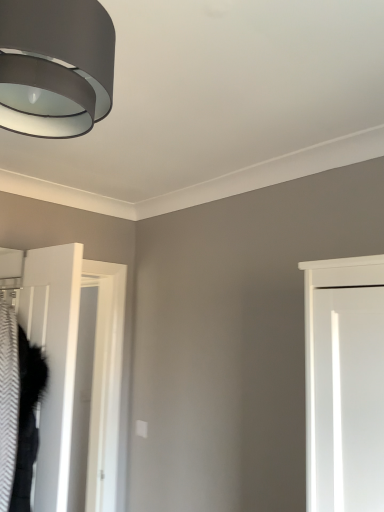
This screenshot has width=384, height=512. What do you see at coordinates (55, 66) in the screenshot? I see `matte black lampshade at upper left` at bounding box center [55, 66].

Measure the distance between matte black lampshade at upper left and camera.

matte black lampshade at upper left is 25.00 inches from camera.

At what (x,y) coordinates should I click in order to perform the action: click on matte black lampshade at upper left. Please return your answer as a coordinate pair (x, y). This screenshot has width=384, height=512. Looking at the image, I should click on (55, 66).

Describe the element at coordinates (75, 374) in the screenshot. I see `white matte door at left` at that location.

Find the location of a particular element. This screenshot has height=512, width=384. white matte door at left is located at coordinates (75, 374).

Locate an element on the screen. This screenshot has height=512, width=384. matte black lampshade at upper left is located at coordinates (55, 66).

Is matte black lampshade at upper left to the right of white matte door at left from the viewer's perspective?

Yes, matte black lampshade at upper left is to the right of white matte door at left.

Is matte black lampshade at upper left positioned behind white matte door at left?

No, the depth of matte black lampshade at upper left is less than that of white matte door at left.

Is point (48, 68) positioned behind point (54, 379)?

That is False.

From the image's perspective, is matte black lampshade at upper left below white matte door at left?

No, from the image's perspective, matte black lampshade at upper left is not beneath white matte door at left.

From a real-world perspective, does matte black lampshade at upper left sit lower than white matte door at left?

No, from a real-world perspective, matte black lampshade at upper left is not under white matte door at left.

Consider the image. Considering the relative sizes of matte black lampshade at upper left and white matte door at left in the image provided, is matte black lampshade at upper left wider than white matte door at left?

Yes, matte black lampshade at upper left is wider than white matte door at left.

Considering the relative sizes of matte black lampshade at upper left and white matte door at left in the image provided, is matte black lampshade at upper left shorter than white matte door at left?

Yes, matte black lampshade at upper left is shorter than white matte door at left.

Between matte black lampshade at upper left and white matte door at left, which one has larger size?

white matte door at left is bigger.

Is matte black lampshade at upper left completely or partially outside of white matte door at left?

Indeed, matte black lampshade at upper left is completely outside white matte door at left.

Is matte black lampshade at upper left far from white matte door at left?

Absolutely, matte black lampshade at upper left is distant from white matte door at left.

Is matte black lampshade at upper left oriented away from white matte door at left?

That's not correct — matte black lampshade at upper left is not looking away from white matte door at left.

Measure the distance between matte black lampshade at upper left and white matte door at left.

They are 5.99 feet apart.

The width and height of the screenshot is (384, 512). I want to click on door below the matte black lampshade at upper left (from a real-world perspective), so click(75, 374).

Which object is positioned more to the right, white matte door at left or matte black lampshade at upper left?

matte black lampshade at upper left is more to the right.

In the scene shown: Which object is further away from the camera, white matte door at left or matte black lampshade at upper left?

white matte door at left is behind.

Which is behind, point (113, 392) or point (59, 9)?

The point (113, 392) is more distant.

From the picture: From the image's perspective, between white matte door at left and matte black lampshade at upper left, who is located below?

white matte door at left is shown below in the image.

From a real-world perspective, is white matte door at left on matte black lampshade at upper left?

No, from a real-world perspective, white matte door at left is not on top of matte black lampshade at upper left.

Considering the sizes of white matte door at left and matte black lampshade at upper left in the image, is white matte door at left wider or thinner than matte black lampshade at upper left?

Clearly, white matte door at left has less width compared to matte black lampshade at upper left.

Who is shorter, white matte door at left or matte black lampshade at upper left?

matte black lampshade at upper left.

Considering the sizes of objects white matte door at left and matte black lampshade at upper left in the image provided, who is bigger, white matte door at left or matte black lampshade at upper left?

With larger size is white matte door at left.

Is white matte door at left positioned beyond the bounds of matte black lampshade at upper left?

Yes, white matte door at left is outside of matte black lampshade at upper left.

Is there a large distance between white matte door at left and matte black lampshade at upper left?

Yes, white matte door at left and matte black lampshade at upper left are quite far apart.

Is white matte door at left turned away from matte black lampshade at upper left?

No, white matte door at left is not facing the opposite direction of matte black lampshade at upper left.

How different are the orientations of white matte door at left and matte black lampshade at upper left in degrees?

The facing directions of white matte door at left and matte black lampshade at upper left are 80.4 degrees apart.

This screenshot has height=512, width=384. I want to click on door lying behind the matte black lampshade at upper left, so click(75, 374).

Find the location of a particular element. lamp in front of the white matte door at left is located at coordinates (55, 66).

I want to click on door behind the matte black lampshade at upper left, so (x=75, y=374).